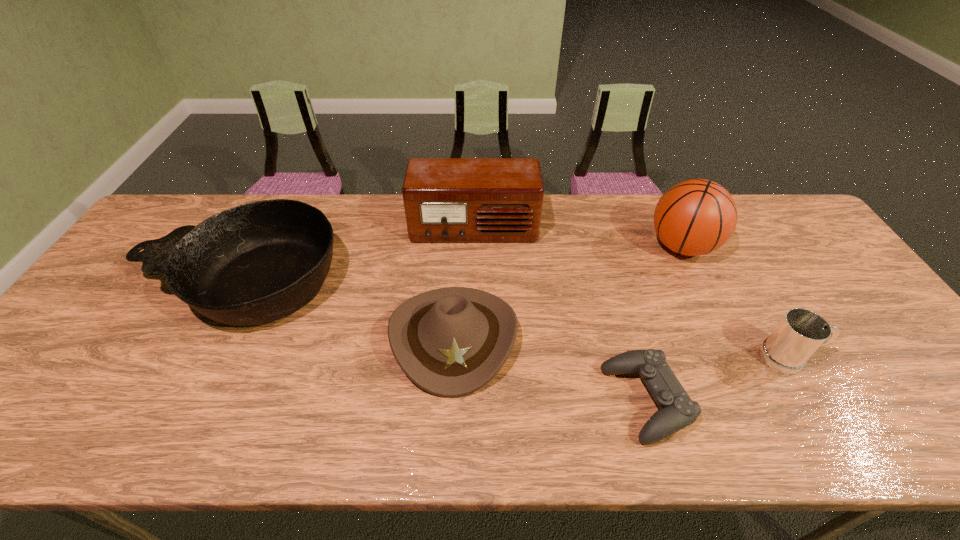
You are a GUI agent. You are given a task and a screenshot of the screen. Output one action in this format:
    pyautogui.click(x=<x>, y=<y>)
    Task: Click on the free space between the basketball and the radio receiver
    This screenshot has height=540, width=960.
    Given the screenshot: What is the action you would take?
    pyautogui.click(x=578, y=238)

Where is `free spot between the frying pan and the basketball`? free spot between the frying pan and the basketball is located at coordinates (463, 265).

At what (x,y) coordinates should I click in order to perform the action: click on free space between the radio receiver and the leftmost object. Please return your answer as a coordinate pair (x, y). The width and height of the screenshot is (960, 540). Looking at the image, I should click on (358, 256).

This screenshot has width=960, height=540. In order to click on free space between the mug and the cowboy hat in this screenshot , I will do `click(621, 347)`.

The height and width of the screenshot is (540, 960). Identify the location of object that is the fourth closest to the leftmost object. click(695, 217).

Find the location of `object that is the fourth closest to the radio receiver`. object that is the fourth closest to the radio receiver is located at coordinates (677, 411).

Image resolution: width=960 pixels, height=540 pixels. What are the coordinates of `vacant space that satisfies the following two spatial constraints: 1. with the handle extending from the side of the frying pan; 2. on the left side of the basketball` in the screenshot? It's located at (261, 247).